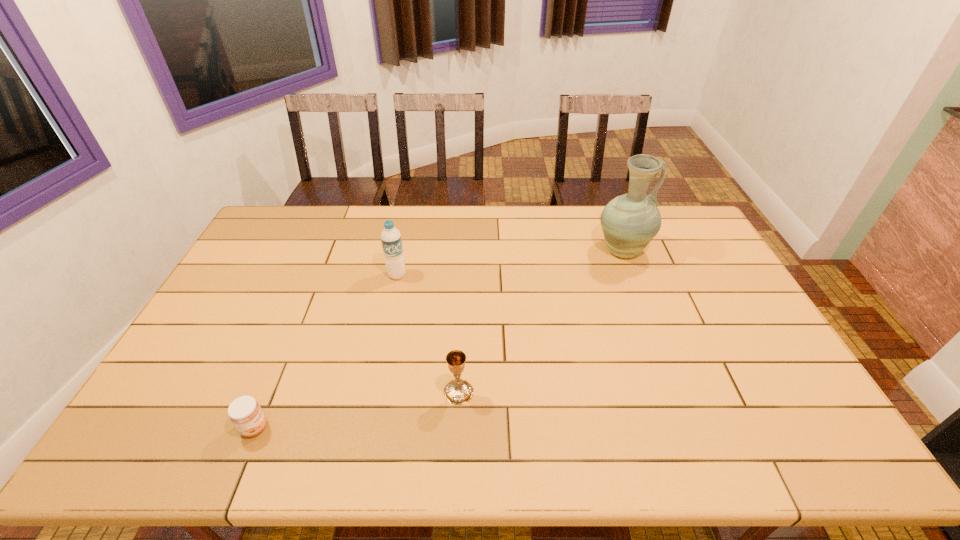
Locate an element on the screen. free space located 0.280m on the right of the third object from left to right is located at coordinates (583, 392).

I want to click on free location located on the front label of the shortest object, so click(360, 428).

Where is `object that is at the far edge`? object that is at the far edge is located at coordinates pos(630,221).

Where is `object at the near edge`? The image size is (960, 540). object at the near edge is located at coordinates (245, 413).

In the image, there is a desktop. Find the location of `vacant area at the far edge`. vacant area at the far edge is located at coordinates (557, 216).

Locate an element on the screen. The height and width of the screenshot is (540, 960). free location at the near edge is located at coordinates (257, 436).

Find the location of a particular element. The image size is (960, 540). free space at the near left corner of the desktop is located at coordinates (139, 440).

This screenshot has height=540, width=960. I want to click on vacant space at the far right corner of the desktop, so 669,233.

The height and width of the screenshot is (540, 960). I want to click on vacant space at the near right corner of the desktop, so click(x=785, y=454).

The height and width of the screenshot is (540, 960). Find the location of `free space between the third object from right to left and the tallest object`. free space between the third object from right to left and the tallest object is located at coordinates (510, 263).